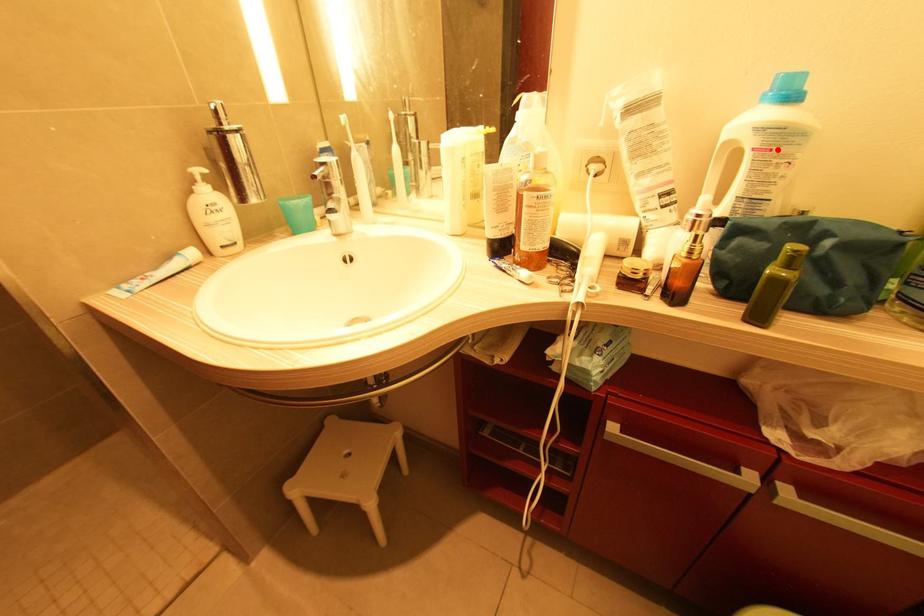
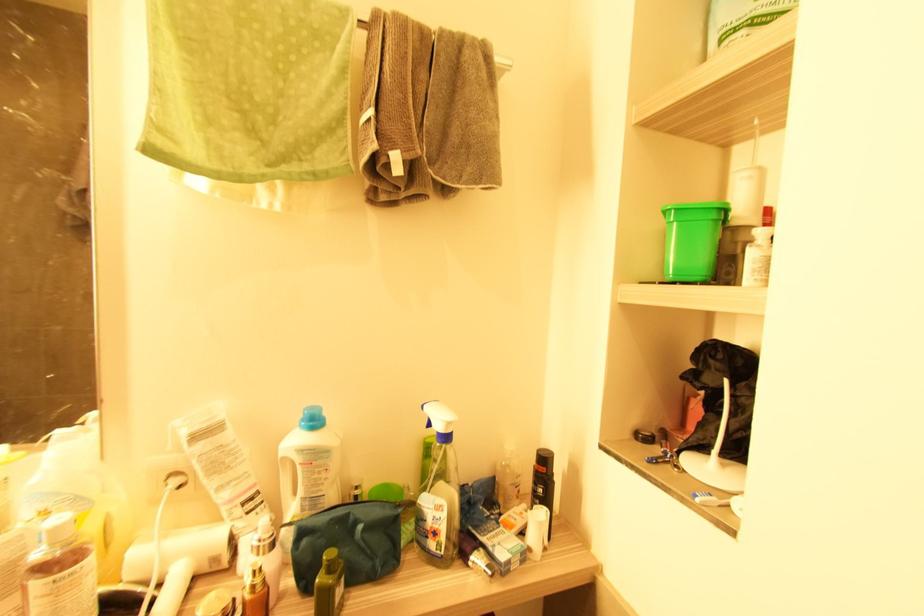
The point at the highlighted location is marked in the first image. Where is the corresponding point in the second image?

(315, 464)